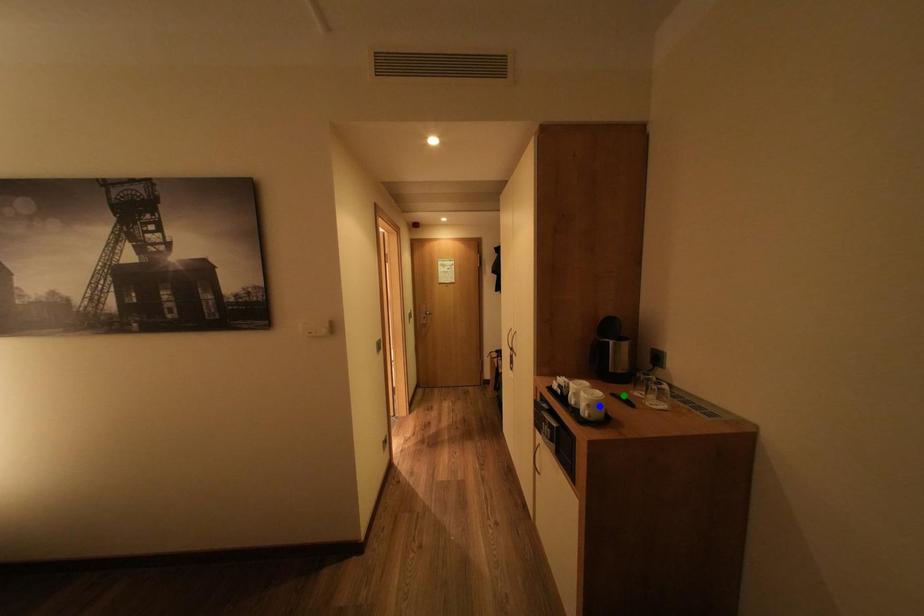
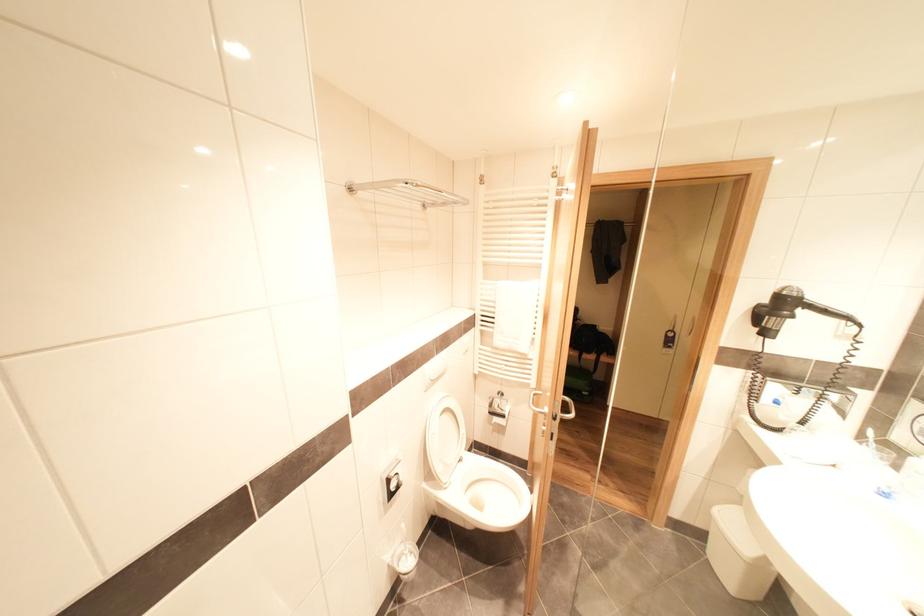
I am providing you with two images of the same scene from different viewpoints. Three points are marked in image1. Which point corresponds to a part or object that is occluded in image2?In image1, three points are marked. Which of them correspond to a part or object that is occluded in image2?Among the three points shown in image1, which one corresponds to a part or object that is no longer visible due to occlusion in image2?

green point, yellow point, blue point